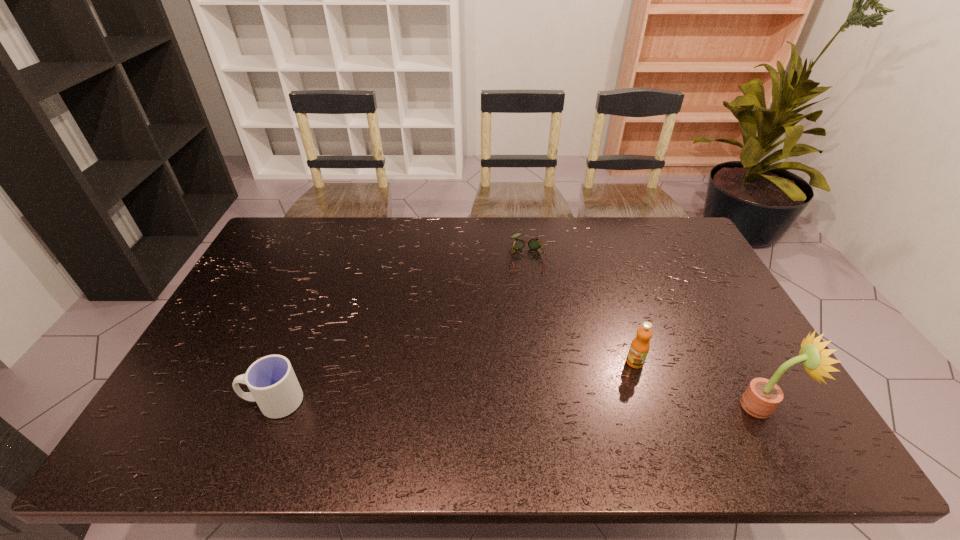
Where is `free space located 0.170m with the handle on the side of the cup`? The height and width of the screenshot is (540, 960). free space located 0.170m with the handle on the side of the cup is located at coordinates (175, 401).

The width and height of the screenshot is (960, 540). Find the location of `free space located on the front-facing side of the second object from left to right`. free space located on the front-facing side of the second object from left to right is located at coordinates (540, 364).

This screenshot has width=960, height=540. Find the location of `free space located 0.050m on the front-facing side of the second object from left to right`. free space located 0.050m on the front-facing side of the second object from left to right is located at coordinates (530, 284).

You are a GUI agent. You are given a task and a screenshot of the screen. Output one action in this format:
    pyautogui.click(x=<x>, y=<y>)
    Task: Click on the blank space located on the front-facing side of the second object from left to right
    The image size is (960, 540).
    Given the screenshot: What is the action you would take?
    pyautogui.click(x=537, y=330)

The width and height of the screenshot is (960, 540). In order to click on blank area located 0.110m on the front label of the second tallest object in this screenshot , I will do `click(600, 386)`.

The width and height of the screenshot is (960, 540). What are the coordinates of `free location located 0.200m on the front label of the second tallest object` in the screenshot? It's located at pyautogui.click(x=574, y=404).

Identify the location of vacant space positioned 0.050m on the front label of the second tallest object. Image resolution: width=960 pixels, height=540 pixels. (616, 375).

I want to click on object situated at the far edge, so click(535, 244).

You are a GUI agent. You are given a task and a screenshot of the screen. Output one action in this format:
    pyautogui.click(x=<x>, y=<y>)
    Task: Click on the cup at the near edge
    
    Given the screenshot: What is the action you would take?
    pyautogui.click(x=273, y=385)

Where is `sunflower that is at the near edge`? sunflower that is at the near edge is located at coordinates (762, 396).